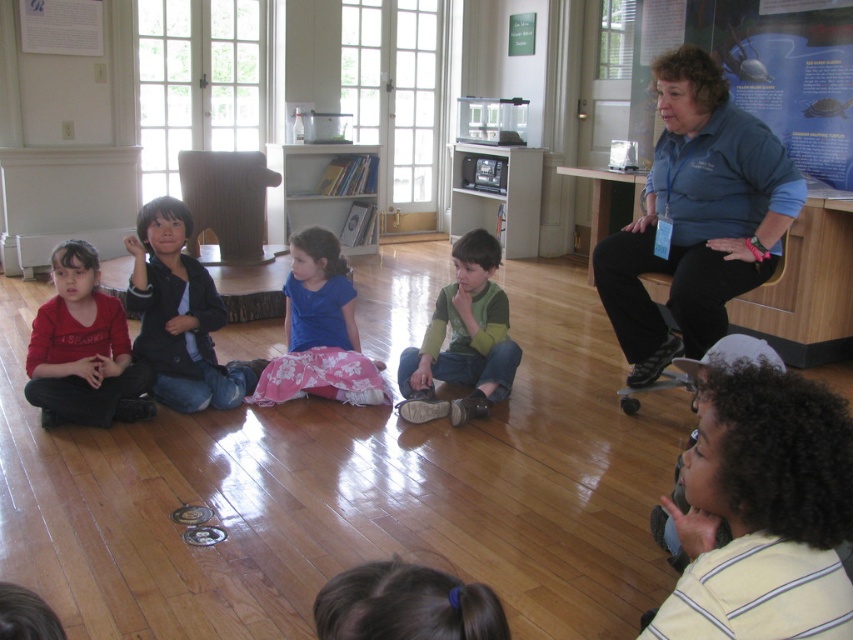
Does matte red shirt at lower left have a smaller size compared to green suede shoes at center?

Indeed, matte red shirt at lower left has a smaller size compared to green suede shoes at center.

I want to click on matte red shirt at lower left, so click(83, 349).

Is matte red shirt at lower left thinner than brown hair at lower center?

In fact, matte red shirt at lower left might be wider than brown hair at lower center.

Between point (74, 323) and point (395, 634), which one is positioned behind?

Positioned behind is point (74, 323).

This screenshot has width=853, height=640. In order to click on matte red shirt at lower left in this screenshot , I will do `click(83, 349)`.

Who is higher up, green suede shoes at center or brown hair at lower center?

green suede shoes at center

Image resolution: width=853 pixels, height=640 pixels. In order to click on green suede shoes at center in this screenshot , I will do `click(462, 340)`.

At what (x,y) coordinates should I click in order to perform the action: click on green suede shoes at center. Please return your answer as a coordinate pair (x, y). Looking at the image, I should click on (462, 340).